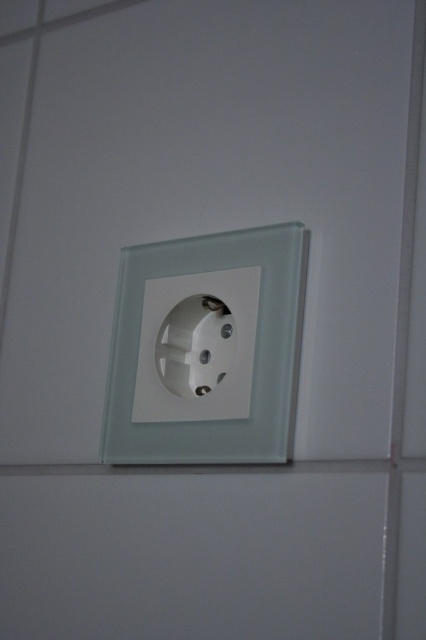
Between transparent glass socket at center and white plastic socket at center, which one appears on the left side from the viewer's perspective?

white plastic socket at center

Describe the element at coordinates (207, 348) in the screenshot. I see `transparent glass socket at center` at that location.

The width and height of the screenshot is (426, 640). I want to click on transparent glass socket at center, so click(207, 348).